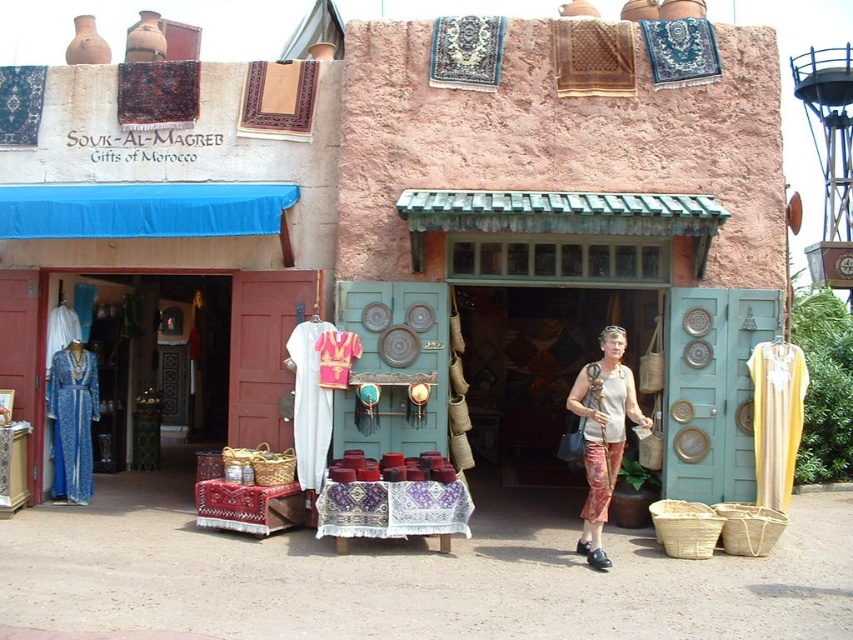
Who is lower down, matte beige purse at center or blue silk dress at left?

blue silk dress at left

Which is above, matte beige purse at center or blue silk dress at left?

matte beige purse at center is higher up.

Is point (567, 408) farther from camera compared to point (86, 358)?

That is False.

Identify the location of matte beige purse at center. Image resolution: width=853 pixels, height=640 pixels. (602, 435).